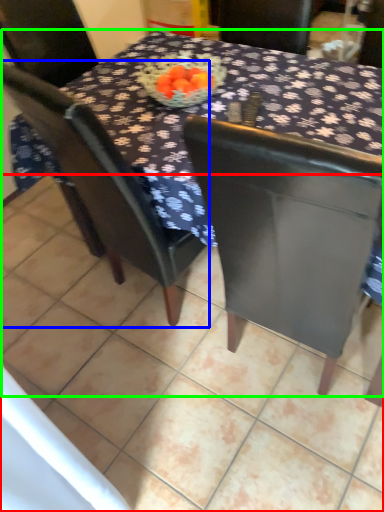
Question: Considering the real-world distances, which object is farthest from tile (highlighted by a red box)? chair (highlighted by a blue box) or table (highlighted by a green box)?

Choices:
 (A) chair
 (B) table

Answer: (B)